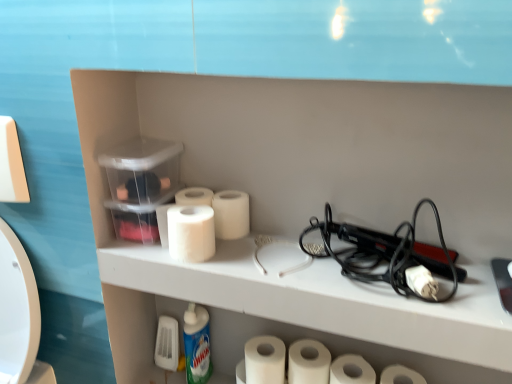
The width and height of the screenshot is (512, 384). What do you see at coordinates (421, 282) in the screenshot?
I see `white matte toilet paper at center, placed as the 2th toilet paper when sorted from right to left` at bounding box center [421, 282].

Find the location of a particular element. white matte toilet paper at center, marked as the 5th toilet paper in a left-to-right arrangement is located at coordinates (421, 282).

This screenshot has width=512, height=384. Describe the element at coordinates (308, 362) in the screenshot. I see `white matte paper towel at center` at that location.

In order to face white matte toilet paper at center, marked as the 2th toilet paper in a left-to-right arrangement, should I rotate leftwards or rightwards?

A 3.606 degree turn to the left will do.

Find the location of a particular element. This screenshot has width=512, height=384. white glossy bottle at lower center is located at coordinates (197, 344).

The image size is (512, 384). Describe the element at coordinates (303, 304) in the screenshot. I see `white matte hairdryer at upper center` at that location.

This screenshot has width=512, height=384. Find the location of `white matte toilet paper at center, which appears as the 3th toilet paper when viewed from the left`. white matte toilet paper at center, which appears as the 3th toilet paper when viewed from the left is located at coordinates (264, 360).

At what (x,y) coordinates should I click in order to perform the action: click on white matte toilet paper at center, marked as the 5th toilet paper in a left-to-right arrangement. Please return your answer as a coordinate pair (x, y). The height and width of the screenshot is (384, 512). Looking at the image, I should click on (421, 282).

Based on their positions, is white matte hairdryer at upper center located to the left or right of white matte toilet paper at lower center, which ranks as the 4th toilet paper in left-to-right order?

white matte hairdryer at upper center is to the left of white matte toilet paper at lower center, which ranks as the 4th toilet paper in left-to-right order.

From the image's perspective, is white matte hairdryer at upper center beneath white matte toilet paper at lower center, which ranks as the 4th toilet paper in left-to-right order?

No, from the image's perspective, white matte hairdryer at upper center is not below white matte toilet paper at lower center, which ranks as the 4th toilet paper in left-to-right order.

Is white matte hairdryer at upper center aimed at white matte toilet paper at lower center, which ranks as the 4th toilet paper in left-to-right order?

No, white matte hairdryer at upper center is not aimed at white matte toilet paper at lower center, which ranks as the 4th toilet paper in left-to-right order.

Considering the sizes of white matte toilet paper at center, marked as the 5th toilet paper in a left-to-right arrangement, and white matte hairdryer at upper center in the image, is white matte toilet paper at center, marked as the 5th toilet paper in a left-to-right arrangement, bigger or smaller than white matte hairdryer at upper center?

Clearly, white matte toilet paper at center, marked as the 5th toilet paper in a left-to-right arrangement, is smaller in size than white matte hairdryer at upper center.

Considering the positions of point (420, 278) and point (119, 256), is point (420, 278) closer or farther from the camera than point (119, 256)?

Point (420, 278) is positioned closer to the camera compared to point (119, 256).

Is white matte toilet paper at center, placed as the 2th toilet paper when sorted from right to left, oriented towards white matte hairdryer at upper center?

No, white matte toilet paper at center, placed as the 2th toilet paper when sorted from right to left, is not facing towards white matte hairdryer at upper center.

From the image's perspective, which is above, white matte toilet paper at center, marked as the 5th toilet paper in a left-to-right arrangement, or white matte hairdryer at upper center?

white matte toilet paper at center, marked as the 5th toilet paper in a left-to-right arrangement, is shown above in the image.

From a real-world perspective, is white matte toilet paper at lower center, acting as the 6th toilet paper starting from the left, on top of white matte paper towel at center?

Yes, from a real-world perspective, white matte toilet paper at lower center, acting as the 6th toilet paper starting from the left, is over white matte paper towel at center

Are white matte toilet paper at lower center, acting as the 6th toilet paper starting from the left, and white matte paper towel at center beside each other?

white matte toilet paper at lower center, acting as the 6th toilet paper starting from the left, and white matte paper towel at center are clearly separated.

Considering the sizes of objects white matte toilet paper at lower center, the first toilet paper in the right-to-left sequence, and white matte paper towel at center in the image provided, who is thinner, white matte toilet paper at lower center, the first toilet paper in the right-to-left sequence, or white matte paper towel at center?

white matte paper towel at center is thinner.

Is white matte toilet paper at lower center, which ranks as the 4th toilet paper in left-to-right order, taller or shorter than white matte toilet paper at lower center, acting as the 6th toilet paper starting from the left?

white matte toilet paper at lower center, which ranks as the 4th toilet paper in left-to-right order, is shorter than white matte toilet paper at lower center, acting as the 6th toilet paper starting from the left.

Is white matte toilet paper at lower center, which is the 3th toilet paper from right to left, far from white matte toilet paper at lower center, the first toilet paper in the right-to-left sequence?

No, white matte toilet paper at lower center, which is the 3th toilet paper from right to left, is not far from white matte toilet paper at lower center, the first toilet paper in the right-to-left sequence.

Considering the positions of objects white matte toilet paper at lower center, which ranks as the 4th toilet paper in left-to-right order, and white matte toilet paper at lower center, the first toilet paper in the right-to-left sequence, in the image provided, who is more to the right, white matte toilet paper at lower center, which ranks as the 4th toilet paper in left-to-right order, or white matte toilet paper at lower center, the first toilet paper in the right-to-left sequence,?

white matte toilet paper at lower center, the first toilet paper in the right-to-left sequence, is more to the right.

From a real-world perspective, between white matte toilet paper at lower center, which ranks as the 4th toilet paper in left-to-right order, and white matte toilet paper at lower center, the first toilet paper in the right-to-left sequence, who is vertically lower?

white matte toilet paper at lower center, which ranks as the 4th toilet paper in left-to-right order.

Considering the points (373, 373) and (192, 299), which point is behind, point (373, 373) or point (192, 299)?

The point (373, 373) is more distant.

Can you confirm if white matte toilet paper at lower center, which is the 3th toilet paper from right to left, is smaller than white matte hairdryer at upper center?

Correct, white matte toilet paper at lower center, which is the 3th toilet paper from right to left, occupies less space than white matte hairdryer at upper center.

Is white matte hairdryer at upper center a part of white matte toilet paper at lower center, which ranks as the 4th toilet paper in left-to-right order?

Actually, white matte hairdryer at upper center is outside white matte toilet paper at lower center, which ranks as the 4th toilet paper in left-to-right order.

Which object is positioned more to the right, white matte toilet paper at lower center, which is the 3th toilet paper from right to left, or white matte hairdryer at upper center?

From the viewer's perspective, white matte toilet paper at lower center, which is the 3th toilet paper from right to left, appears more on the right side.

From the image's perspective, does white matte toilet paper at lower center, which ranks as the 4th toilet paper in left-to-right order, appear higher than white matte toilet paper at center, marked as the 2th toilet paper in a left-to-right arrangement?

Incorrect, from the image's perspective, white matte toilet paper at lower center, which ranks as the 4th toilet paper in left-to-right order, is lower than white matte toilet paper at center, marked as the 2th toilet paper in a left-to-right arrangement.

From the picture: Could you tell me if white matte toilet paper at lower center, which ranks as the 4th toilet paper in left-to-right order, is turned towards white matte toilet paper at center, which ranks as the 5th toilet paper in right-to-left order?

No, white matte toilet paper at lower center, which ranks as the 4th toilet paper in left-to-right order, is not oriented towards white matte toilet paper at center, which ranks as the 5th toilet paper in right-to-left order.

Which is farther from the camera, (353, 370) or (243, 225)?

The point (353, 370) is behind.

Would you say white matte toilet paper at lower center, which is the 3th toilet paper from right to left, is part of white matte toilet paper at center, positioned as the 4th toilet paper in right-to-left order,'s contents?

Definitely not — white matte toilet paper at lower center, which is the 3th toilet paper from right to left, is not inside white matte toilet paper at center, positioned as the 4th toilet paper in right-to-left order.

Is white matte toilet paper at center, positioned as the 4th toilet paper in right-to-left order, taller than white matte toilet paper at lower center, which is the 3th toilet paper from right to left?

No, white matte toilet paper at center, positioned as the 4th toilet paper in right-to-left order, is not taller than white matte toilet paper at lower center, which is the 3th toilet paper from right to left.

From a real-world perspective, is white matte toilet paper at center, positioned as the 4th toilet paper in right-to-left order, above or below white matte toilet paper at lower center, which is the 3th toilet paper from right to left?

white matte toilet paper at center, positioned as the 4th toilet paper in right-to-left order, is below white matte toilet paper at lower center, which is the 3th toilet paper from right to left.

Find the location of a particular element. counter that appears on the left of white matte toilet paper at lower center, which is the 3th toilet paper from right to left is located at coordinates (303, 304).

Find the location of `counter in front of the white matte toilet paper at center, marked as the 5th toilet paper in a left-to-right arrangement`. counter in front of the white matte toilet paper at center, marked as the 5th toilet paper in a left-to-right arrangement is located at coordinates 303,304.

Considering their positions, is white glossy bottle at lower center positioned closer to white matte paper towel at center than white matte toilet paper at center, positioned as the 4th toilet paper in right-to-left order?

The object closer to white matte paper towel at center is white matte toilet paper at center, positioned as the 4th toilet paper in right-to-left order.

Based on their spatial positions, is white matte toilet paper at lower center, which is the 3th toilet paper from right to left, or white matte toilet paper at center, positioned as the 4th toilet paper in right-to-left order, closer to white glossy bottle at lower center?

Among the two, white matte toilet paper at center, positioned as the 4th toilet paper in right-to-left order, is located nearer to white glossy bottle at lower center.

Based on their spatial positions, is white glossy bottle at lower center or white matte toilet paper at center, marked as the 2th toilet paper in a left-to-right arrangement, closer to white matte paper towel at center?

white glossy bottle at lower center is positioned closer to the anchor white matte paper towel at center.

Which object lies further to the anchor point white matte toilet paper at center, marked as the 2th toilet paper in a left-to-right arrangement, white matte hairdryer at upper center or white matte toilet paper at center, which appears as the 3th toilet paper when viewed from the left?

white matte toilet paper at center, which appears as the 3th toilet paper when viewed from the left, is further to white matte toilet paper at center, marked as the 2th toilet paper in a left-to-right arrangement.

Based on their spatial positions, is black plastic hair straightener at right or white matte toilet paper at center, positioned as the 4th toilet paper in right-to-left order, further from white matte toilet paper at center, which ranks as the sixth toilet paper in right-to-left order?

Based on the image, white matte toilet paper at center, positioned as the 4th toilet paper in right-to-left order, appears to be further to white matte toilet paper at center, which ranks as the sixth toilet paper in right-to-left order.

Considering their positions, is white glossy bottle at lower center positioned closer to white matte toilet paper at lower center, which ranks as the 4th toilet paper in left-to-right order, than white matte toilet paper at lower center, acting as the 6th toilet paper starting from the left?

Based on the image, white matte toilet paper at lower center, acting as the 6th toilet paper starting from the left, appears to be nearer to white matte toilet paper at lower center, which ranks as the 4th toilet paper in left-to-right order.

Based on their spatial positions, is white matte toilet paper at lower center, which ranks as the 4th toilet paper in left-to-right order, or white matte hairdryer at upper center further from white glossy bottle at lower center?

Based on the image, white matte toilet paper at lower center, which ranks as the 4th toilet paper in left-to-right order, appears to be further to white glossy bottle at lower center.

Considering their positions, is white glossy bottle at lower center positioned closer to white matte hairdryer at upper center than white matte toilet paper at lower center, which is the 3th toilet paper from right to left?

white glossy bottle at lower center is closer to white matte hairdryer at upper center.

In order to click on equipment between white matte toilet paper at center, marked as the 2th toilet paper in a left-to-right arrangement, and white matte paper towel at center from top to bottom in this screenshot , I will do `click(386, 253)`.

The image size is (512, 384). I want to click on counter between black plastic hair straightener at right and white matte toilet paper at lower center, the first toilet paper in the right-to-left sequence, in the up-down direction, so click(x=303, y=304).

Identify the location of counter between white matte toilet paper at center, marked as the 2th toilet paper in a left-to-right arrangement, and white matte toilet paper at center, positioned as the 4th toilet paper in right-to-left order, in the vertical direction. Image resolution: width=512 pixels, height=384 pixels. (303, 304).

The width and height of the screenshot is (512, 384). What are the coordinates of `counter located between white glossy bottle at lower center and white matte toilet paper at lower center, acting as the 6th toilet paper starting from the left, in the left-right direction` in the screenshot? It's located at (303, 304).